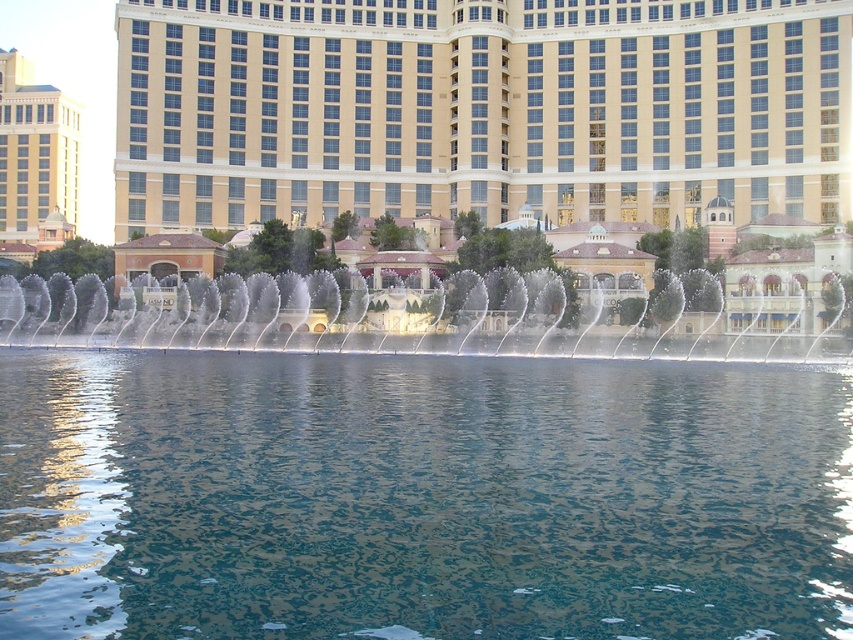
Question: Which point is closer to the camera taking this photo?

Choices:
 (A) (122, 529)
 (B) (32, 179)
 (C) (540, 76)
 (D) (297, 346)

Answer: (A)

Question: Can you confirm if beige/smooth/facade at center is positioned above beige stone building at left?

Choices:
 (A) no
 (B) yes

Answer: (B)

Question: Does clear water at center appear under beige stone building at left?

Choices:
 (A) no
 (B) yes

Answer: (B)

Question: Which object is the farthest from the beige/smooth/facade at center?

Choices:
 (A) clear water at center
 (B) clear water jets at center
 (C) beige stone building at left

Answer: (A)

Question: Which is farther from the beige/smooth/facade at center?

Choices:
 (A) beige stone building at left
 (B) clear water at center
 (C) clear water jets at center

Answer: (B)

Question: Is beige/smooth/facade at center positioned in front of clear water jets at center?

Choices:
 (A) no
 (B) yes

Answer: (A)